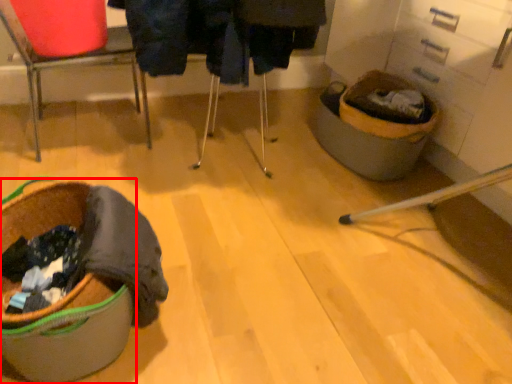
Question: Observing the image, what is the correct spatial positioning of laundry basket (annotated by the red box) in reference to chair?

Choices:
 (A) right
 (B) left

Answer: (A)